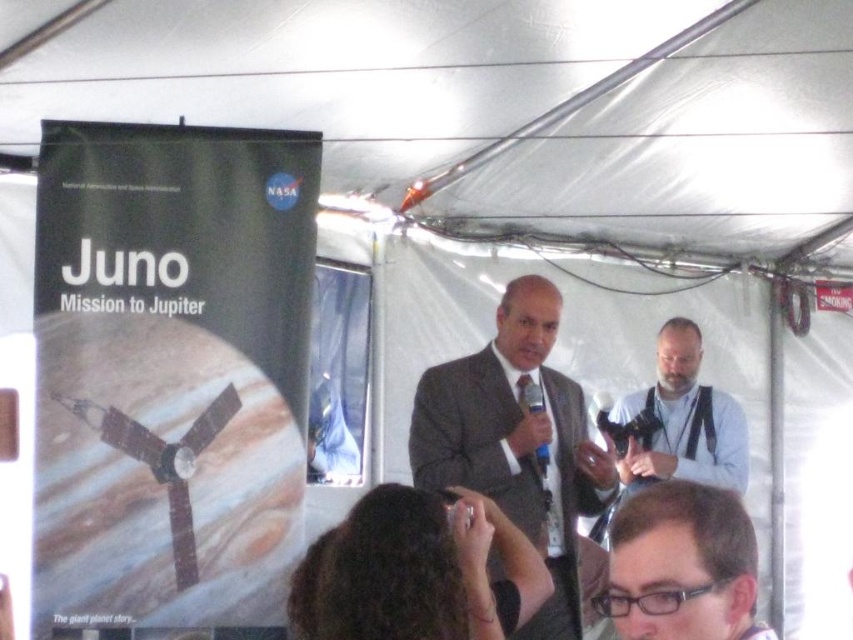
You are at the NASA event and want to take a photo of the Juno Mission banner. You are standing at point (648, 516). If you move directly towards point (538, 449), will the banner become more visible in your view?

Yes, because point (538, 449) is behind point (648, 516). Moving towards the banner would bring you closer to it, making it more visible.

You are attending a NASA event and notice a point at coordinates (x=682, y=564). Based on the scene description, where exactly is this point located?

The point at coordinates (x=682, y=564) is located on the clear plastic glasses at center.